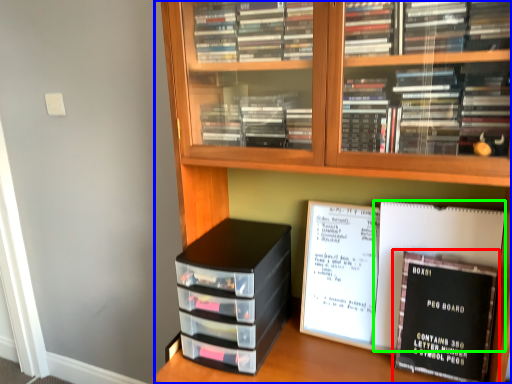
Question: Which is nearer to the book (highlighted by a red box)? bookcase (highlighted by a blue box) or journal (highlighted by a green box).

Choices:
 (A) bookcase
 (B) journal

Answer: (B)